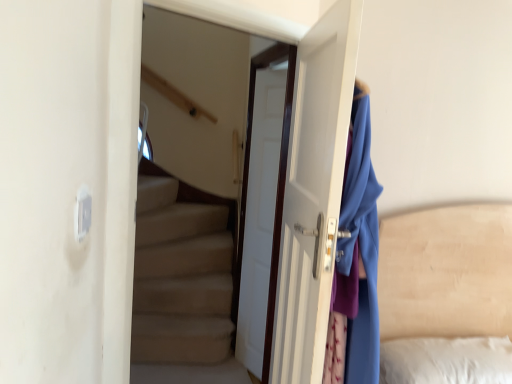
Question: Is white glossy door at center, which is counted as the 1th door, starting from the back, in front of or behind white glossy door at center, placed as the first door when sorted from front to back, in the image?

Choices:
 (A) behind
 (B) front

Answer: (A)

Question: In terms of height, does white glossy door at center, which is counted as the 1th door, starting from the back, look taller or shorter compared to white glossy door at center, placed as the first door when sorted from front to back?

Choices:
 (A) short
 (B) tall

Answer: (B)

Question: Considering the relative positions of white glossy door at center, acting as the second door starting from the front, and white glossy door at center, placed as the first door when sorted from front to back, in the image provided, is white glossy door at center, acting as the second door starting from the front, to the left or to the right of white glossy door at center, placed as the first door when sorted from front to back,?

Choices:
 (A) left
 (B) right

Answer: (A)

Question: Looking at their shapes, would you say white glossy door at center, placed as the first door when sorted from front to back, is wider or thinner than white glossy door at center, which is counted as the 1th door, starting from the back?

Choices:
 (A) wide
 (B) thin

Answer: (A)

Question: Considering their positions, is white glossy door at center, the second door positioned from the back, located in front of or behind white glossy door at center, which is counted as the 1th door, starting from the back?

Choices:
 (A) front
 (B) behind

Answer: (A)

Question: From the image's perspective, is white glossy door at center, placed as the first door when sorted from front to back, above or below white glossy door at center, which is counted as the 1th door, starting from the back?

Choices:
 (A) above
 (B) below

Answer: (B)

Question: Does point (285, 362) appear closer or farther from the camera than point (245, 180)?

Choices:
 (A) farther
 (B) closer

Answer: (B)